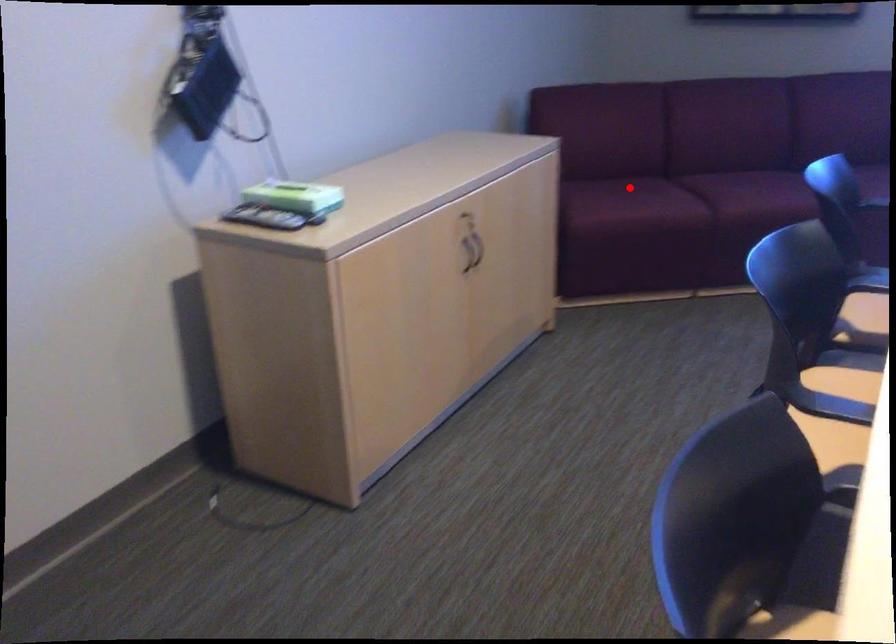
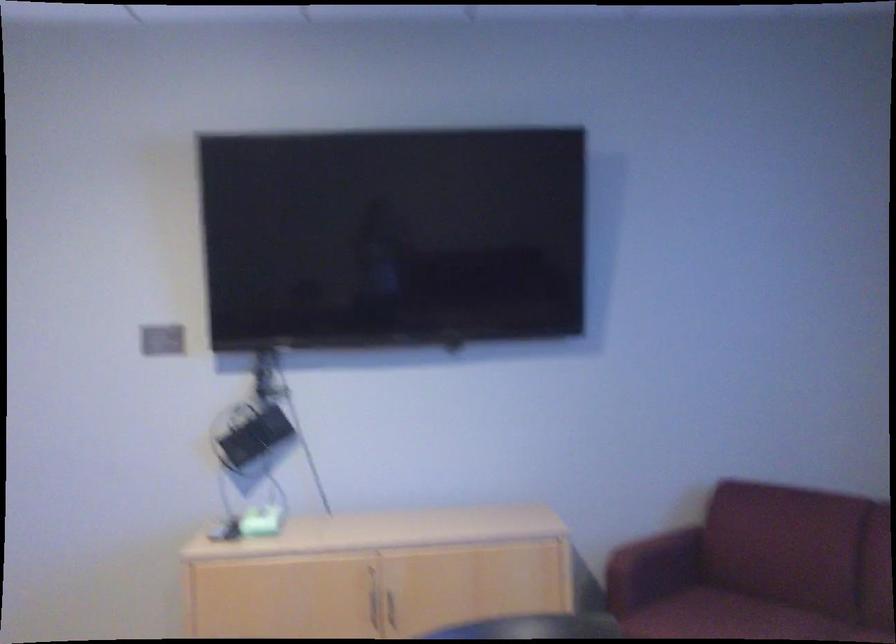
The point at the highlighted location is marked in the first image. Where is the corresponding point in the second image?

(722, 616)